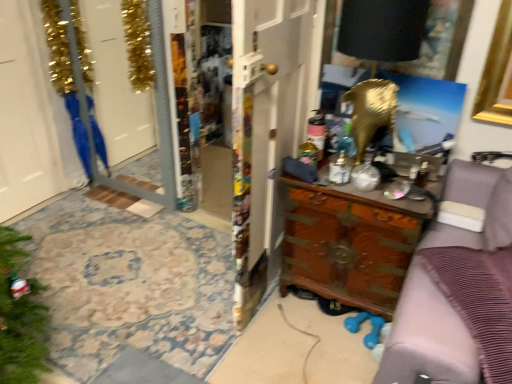
Question: From a real-world perspective, is blue fabric robe at left on top of brown wood dresser at right?

Choices:
 (A) yes
 (B) no

Answer: (B)

Question: From the image's perspective, does blue fabric robe at left appear higher than brown wood dresser at right?

Choices:
 (A) yes
 (B) no

Answer: (A)

Question: Does blue fabric robe at left have a greater width compared to brown wood dresser at right?

Choices:
 (A) no
 (B) yes

Answer: (A)

Question: Is blue fabric robe at left positioned behind brown wood dresser at right?

Choices:
 (A) yes
 (B) no

Answer: (A)

Question: Does blue fabric robe at left have a lesser width compared to brown wood dresser at right?

Choices:
 (A) yes
 (B) no

Answer: (A)

Question: Is blue fabric robe at left closer to camera compared to brown wood dresser at right?

Choices:
 (A) no
 (B) yes

Answer: (A)

Question: Is wooden carved dresser at center far away from clear glass screen door at left?

Choices:
 (A) no
 (B) yes

Answer: (B)

Question: Is wooden carved dresser at center shorter than clear glass screen door at left?

Choices:
 (A) no
 (B) yes

Answer: (B)

Question: From a real-world perspective, does wooden carved dresser at center stand above clear glass screen door at left?

Choices:
 (A) no
 (B) yes

Answer: (A)

Question: Is wooden carved dresser at center next to clear glass screen door at left and touching it?

Choices:
 (A) yes
 (B) no

Answer: (B)

Question: Is wooden carved dresser at center thinner than clear glass screen door at left?

Choices:
 (A) no
 (B) yes

Answer: (A)

Question: From a real-world perspective, is wooden carved dresser at center located beneath clear glass screen door at left?

Choices:
 (A) yes
 (B) no

Answer: (A)

Question: Is brown wood dresser at right looking in the opposite direction of white glossy door at left, which is the 2th door from right to left?

Choices:
 (A) yes
 (B) no

Answer: (B)